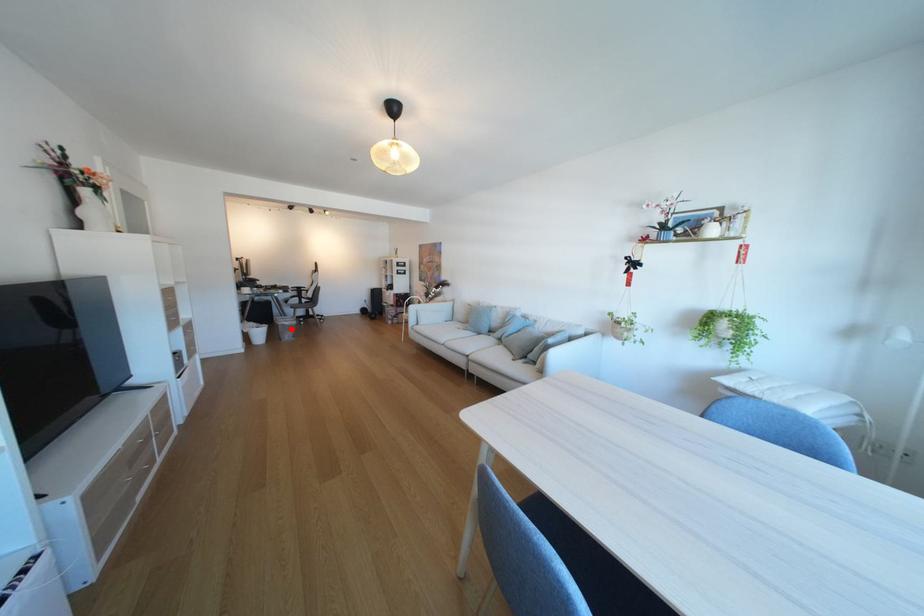
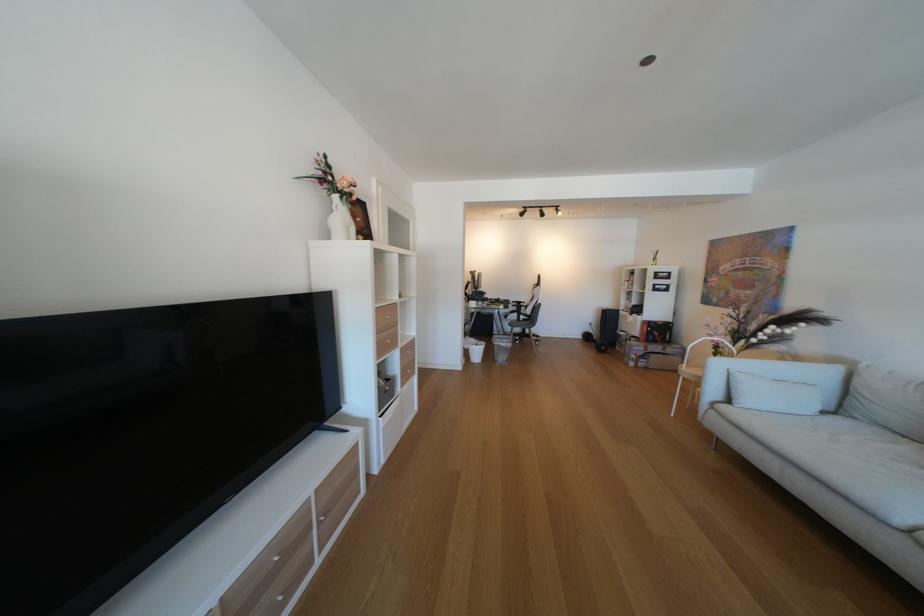
Question: I am providing you with two images of the same scene from different viewpoints. Image1 has a red point marked. In image2, the corresponding 3D location appears at what relative position? Reply with the corresponding letter.

Choices:
 (A) Closer
 (B) Farther

Answer: (B)